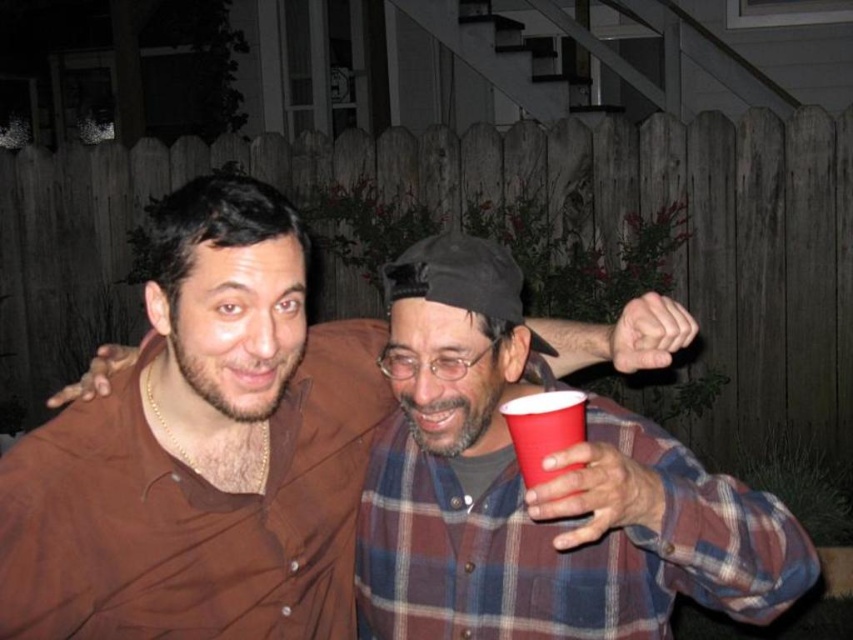
Question: Is plaid fabric at center closer to camera compared to matte plastic cup at lower right?

Choices:
 (A) no
 (B) yes

Answer: (B)

Question: Is plaid fabric at center below matte plastic cup at lower right?

Choices:
 (A) yes
 (B) no

Answer: (A)

Question: Among these objects, which one is nearest to the camera?

Choices:
 (A) matte brown shirt at center
 (B) matte plastic cup at lower right

Answer: (B)

Question: Can you confirm if matte brown shirt at center is positioned to the left of plaid fabric at center?

Choices:
 (A) no
 (B) yes

Answer: (B)

Question: Which of the following is the closest to the observer?

Choices:
 (A) matte brown shirt at center
 (B) matte plastic cup at lower right

Answer: (B)

Question: Estimate the real-world distances between objects in this image. Which object is farther from the matte brown shirt at center?

Choices:
 (A) matte plastic cup at lower right
 (B) plaid fabric at center

Answer: (A)